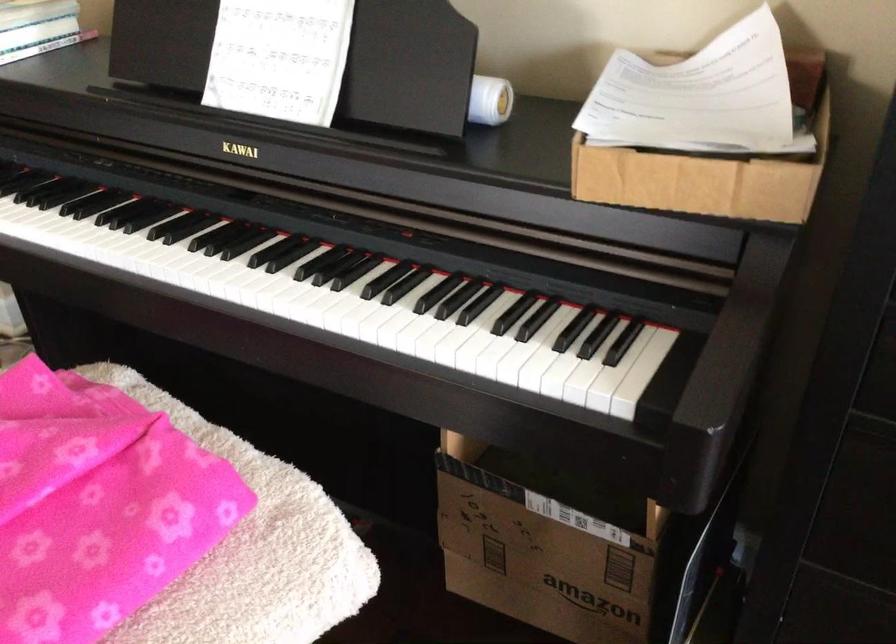
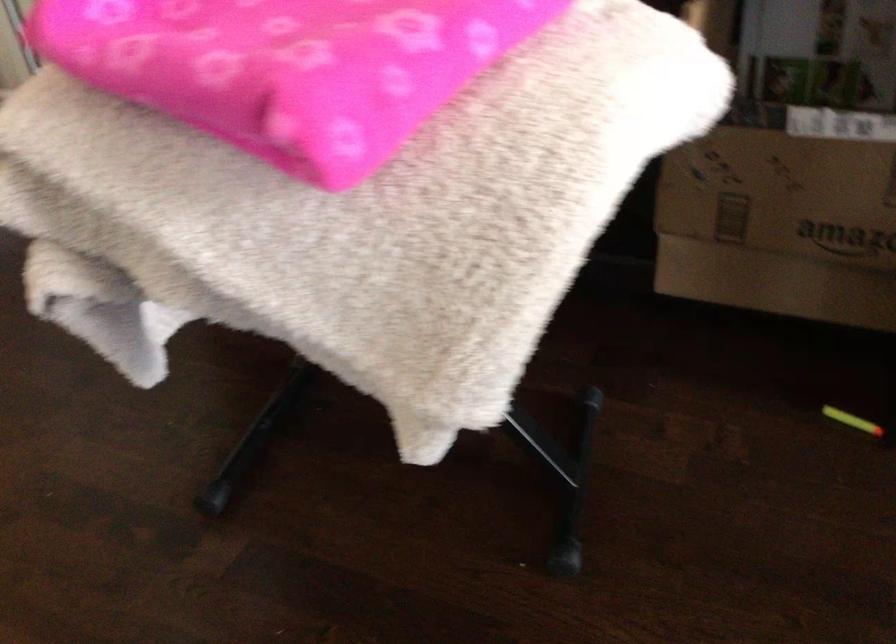
Question: The first image is from the beginning of the video and the second image is from the end. How did the camera likely rotate when shooting the video?

Choices:
 (A) Left
 (B) Right
 (C) Up
 (D) Down

Answer: (B)